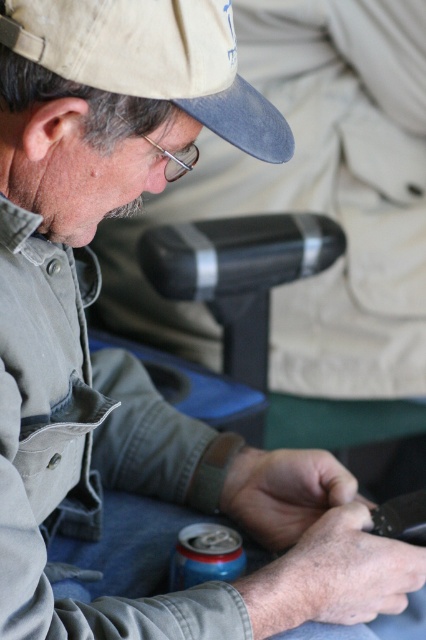
You are standing in front of the scene and want to touch both the matte khaki cap at upper left and the beige fabric cap at upper left. Which one would you reach first?

You would reach the matte khaki cap at upper left first because it is closer to you than the beige fabric cap at upper left.